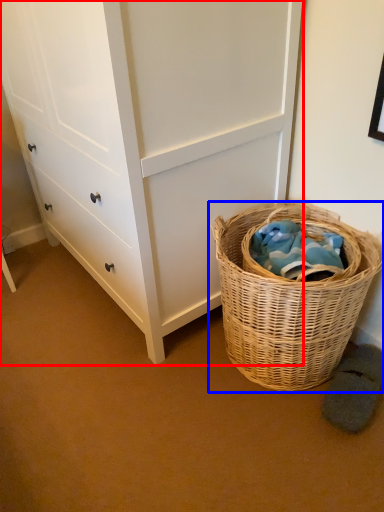
Question: Which of the following is the closest to the observer, chest of drawers (highlighted by a red box) or picnic basket (highlighted by a blue box)?

Choices:
 (A) chest of drawers
 (B) picnic basket

Answer: (A)